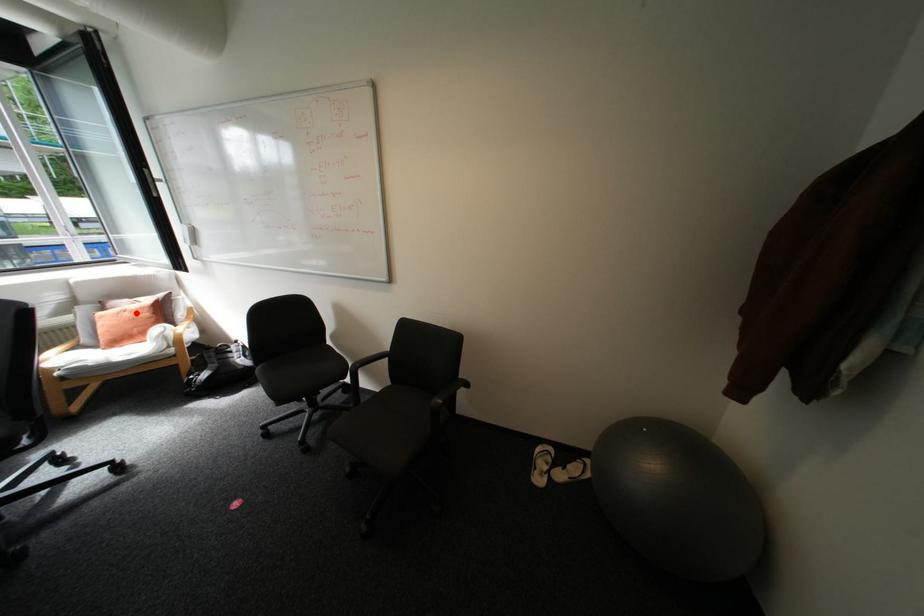
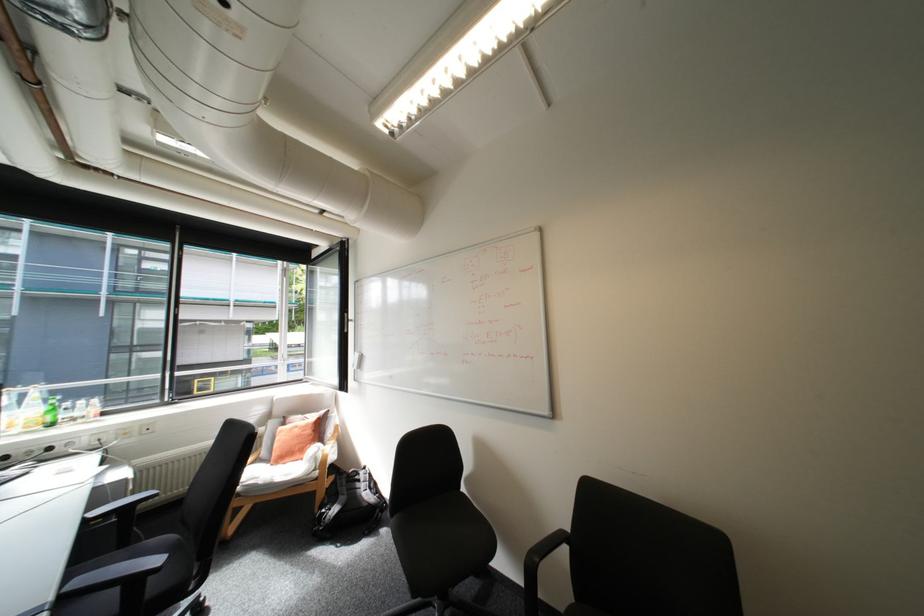
Question: I am providing you with two images of the same scene from different viewpoints. A red point is marked on the first image. Can you still see the location of the red point in image 2?

Choices:
 (A) Yes
 (B) No

Answer: (A)